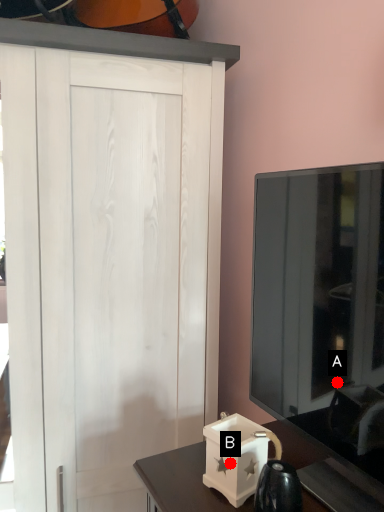
Question: Two points are circled on the image, labeled by A and B beside each circle. Which point is closer to the camera?

Choices:
 (A) A is closer
 (B) B is closer

Answer: (B)